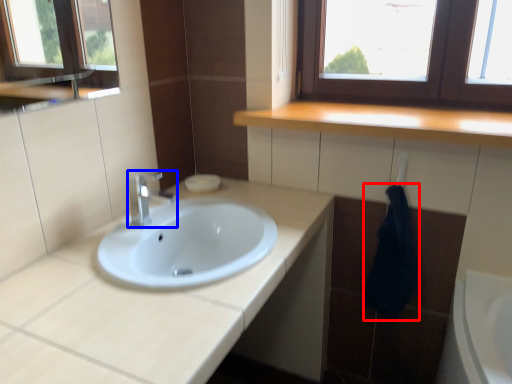
Question: Among these objects, which one is nearest to the camera, bath towel (highlighted by a red box) or tap (highlighted by a blue box)?

Choices:
 (A) bath towel
 (B) tap

Answer: (B)